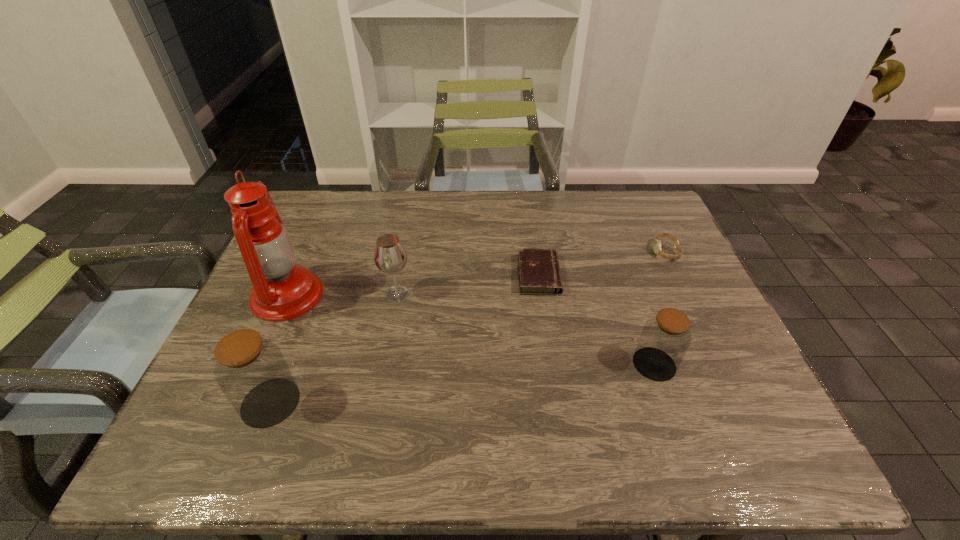
This screenshot has height=540, width=960. What are the coordinates of `vacant region located on the back of the shorter jar` in the screenshot? It's located at (618, 260).

Locate an element on the screen. The width and height of the screenshot is (960, 540). vacant region located 0.330m on the back of the third object from left to right is located at coordinates (413, 213).

This screenshot has width=960, height=540. I want to click on vacant space located 0.320m on the right of the diary, so click(x=678, y=275).

The height and width of the screenshot is (540, 960). I want to click on vacant space located 0.160m on the back of the oil lamp, so click(315, 234).

Locate an element on the screen. free space located 0.090m on the face of the watch is located at coordinates (622, 252).

Where is `vacant space situated 0.200m on the face of the watch`? The height and width of the screenshot is (540, 960). vacant space situated 0.200m on the face of the watch is located at coordinates (585, 252).

Locate an element on the screen. This screenshot has width=960, height=540. free region located on the face of the watch is located at coordinates (581, 252).

Identify the location of jar that is at the left edge. The width and height of the screenshot is (960, 540). (251, 371).

You are a GUI agent. You are given a task and a screenshot of the screen. Output one action in this format:
    pyautogui.click(x=<x>, y=<y>)
    Task: Click on the oil lamp positioned at the left edge
    Image resolution: width=960 pixels, height=540 pixels.
    Given the screenshot: What is the action you would take?
    pyautogui.click(x=282, y=290)

Locate an element on the screen. This screenshot has height=540, width=960. jar at the right edge is located at coordinates (665, 338).